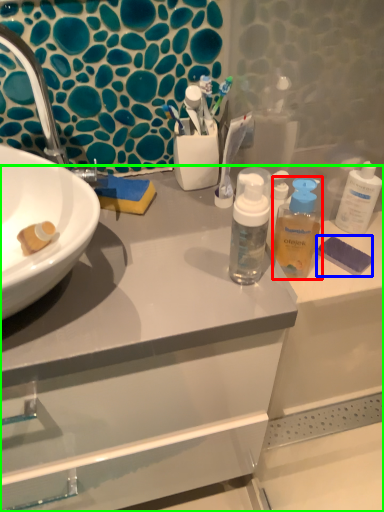
Question: Based on their relative distances, which object is nearer to mouthwash (highlighted by a red box)? Choose from soap (highlighted by a blue box) and bathroom cabinet (highlighted by a green box).

Choices:
 (A) soap
 (B) bathroom cabinet

Answer: (A)